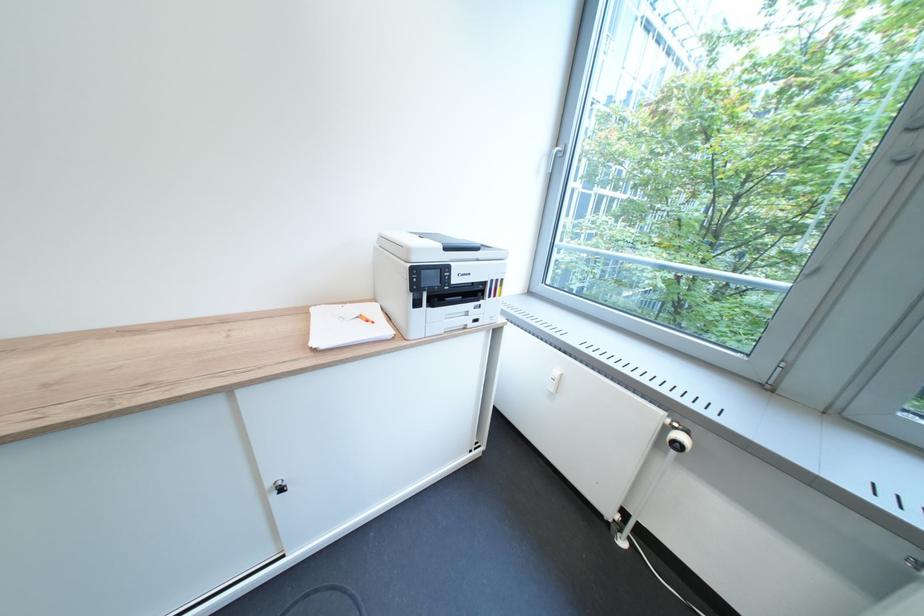
Find the location of a particular element. This screenshot has width=924, height=616. printer paper tray is located at coordinates click(x=483, y=310).